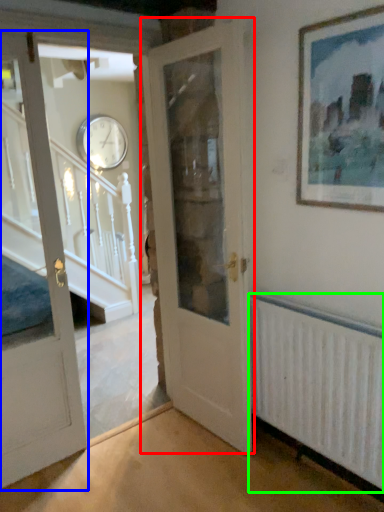
Question: Considering the real-world distances, which object is closest to door (highlighted by a red box)? door (highlighted by a blue box) or radiator (highlighted by a green box).

Choices:
 (A) door
 (B) radiator

Answer: (B)